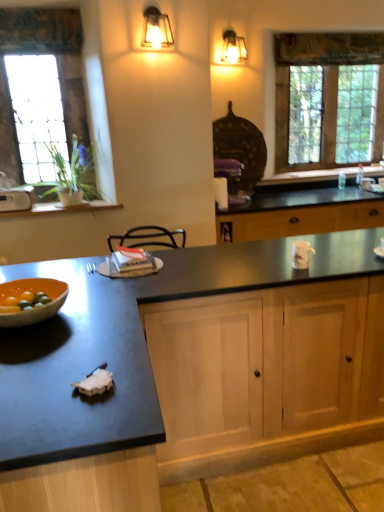
Question: Can you confirm if orange matte bowl at left is thinner than light wood cabinet at center?

Choices:
 (A) yes
 (B) no

Answer: (A)

Question: Is orange matte bowl at left oriented towards light wood cabinet at center?

Choices:
 (A) yes
 (B) no

Answer: (B)

Question: Can you confirm if orange matte bowl at left is wider than light wood cabinet at center?

Choices:
 (A) yes
 (B) no

Answer: (B)

Question: Does orange matte bowl at left appear on the left side of light wood cabinet at center?

Choices:
 (A) yes
 (B) no

Answer: (A)

Question: Is light wood cabinet at center at the back of orange matte bowl at left?

Choices:
 (A) yes
 (B) no

Answer: (B)

Question: Considering the positions of orange matte bowl at left and metallic lantern at upper center, the second light fixture when ordered from back to front, in the image, is orange matte bowl at left bigger or smaller than metallic lantern at upper center, the second light fixture when ordered from back to front,?

Choices:
 (A) big
 (B) small

Answer: (B)

Question: From a real-world perspective, relative to metallic lantern at upper center, which is counted as the second light fixture, starting from the top, is orange matte bowl at left vertically above or below?

Choices:
 (A) above
 (B) below

Answer: (B)

Question: Does point (64, 282) appear closer or farther from the camera than point (150, 30)?

Choices:
 (A) closer
 (B) farther

Answer: (A)

Question: Is orange matte bowl at left inside or outside of metallic lantern at upper center, which is counted as the second light fixture, starting from the top?

Choices:
 (A) inside
 (B) outside

Answer: (B)

Question: Is black granite countertop at center to the left or to the right of clear glass window at upper right, placed as the 1th window when sorted from right to left, in the image?

Choices:
 (A) right
 (B) left

Answer: (B)

Question: Considering the positions of black granite countertop at center and clear glass window at upper right, placed as the 1th window when sorted from right to left, in the image, is black granite countertop at center taller or shorter than clear glass window at upper right, placed as the 1th window when sorted from right to left,?

Choices:
 (A) tall
 (B) short

Answer: (B)

Question: From a real-world perspective, is black granite countertop at center above or below clear glass window at upper right, positioned as the second window in left-to-right order?

Choices:
 (A) above
 (B) below

Answer: (B)

Question: Which is correct: black granite countertop at center is inside clear glass window at upper right, arranged as the first window when viewed from the back, or outside of it?

Choices:
 (A) outside
 (B) inside

Answer: (A)

Question: In the image, is black granite countertop at center positioned in front of or behind metallic lantern at upper center, which is counted as the second light fixture, starting from the top?

Choices:
 (A) front
 (B) behind

Answer: (A)

Question: In terms of height, does black granite countertop at center look taller or shorter compared to metallic lantern at upper center, the second light fixture when ordered from back to front?

Choices:
 (A) tall
 (B) short

Answer: (A)